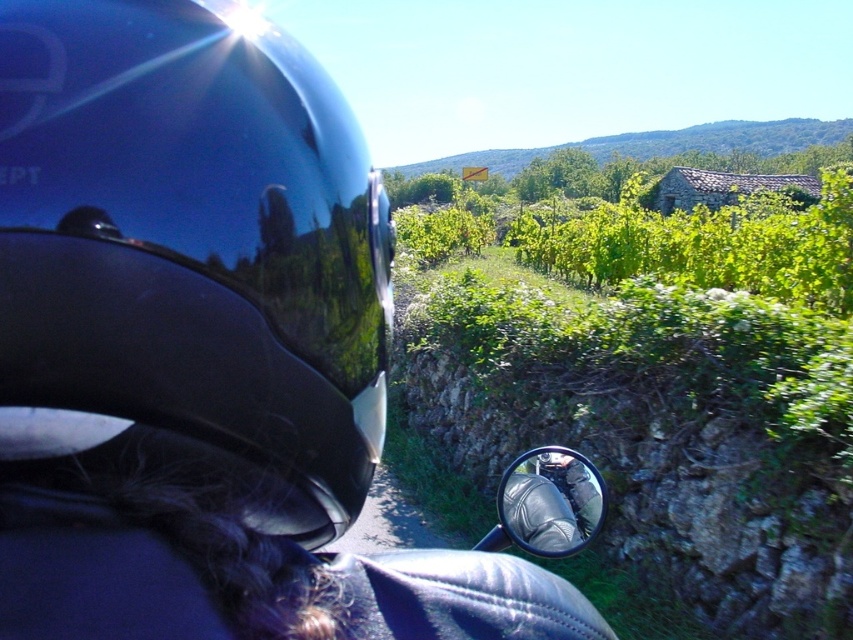
You are a drone pilot trying to capture a photo of the vineyard from above. You notice two points in the scene, point (x=90, y=246) and point (x=515, y=518). Which point is closer to your drone when it is positioned at the camera location?

Point (x=90, y=246) is closer to the camera than point (x=515, y=518).

You are a motorcycle rider wearing a helmet and holding a mirror. You need to check your blind spot while riding. Can you safely turn your head to look at the glossy metallic mirror at center without touching the glossy black helmet at left?

The distance between the glossy black helmet at left and the glossy metallic mirror at center is 31.38 inches, which is sufficient to allow the rider to safely turn their head and look at the glossy metallic mirror at center without coming into contact with the helmet.

You are a motorcyclist approaching a vineyard. You notice a point at coordinates (193, 241). What object is located at that point?

The point at coordinates (193, 241) is occupied by the glossy black helmet at left.